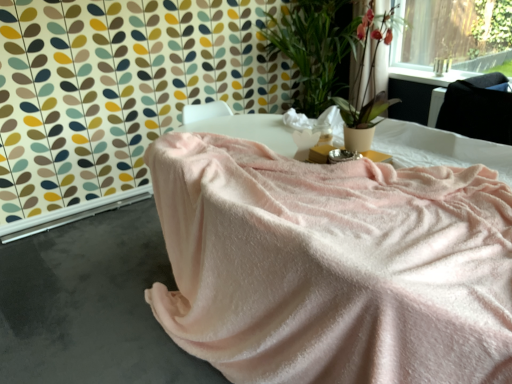
Question: Is pink soft fabric at lower left to the right of green leafy plant at upper right from the viewer's perspective?

Choices:
 (A) no
 (B) yes

Answer: (A)

Question: Is pink soft fabric at lower left located outside green leafy plant at upper right?

Choices:
 (A) yes
 (B) no

Answer: (A)

Question: Is pink soft fabric at lower left surrounding green leafy plant at upper right?

Choices:
 (A) yes
 (B) no

Answer: (B)

Question: From a real-world perspective, is pink soft fabric at lower left beneath green leafy plant at upper right?

Choices:
 (A) yes
 (B) no

Answer: (A)

Question: Is pink soft fabric at lower left positioned with its back to green leafy plant at upper right?

Choices:
 (A) yes
 (B) no

Answer: (B)

Question: In terms of height, does pink soft fabric at lower left look taller or shorter compared to pink fabric at upper right?

Choices:
 (A) tall
 (B) short

Answer: (B)

Question: From the image's perspective, relative to pink fabric at upper right, is pink soft fabric at lower left above or below?

Choices:
 (A) below
 (B) above

Answer: (A)

Question: Do you think pink soft fabric at lower left is within pink fabric at upper right, or outside of it?

Choices:
 (A) inside
 (B) outside

Answer: (B)

Question: Looking at the image, does pink soft fabric at lower left seem bigger or smaller compared to pink fabric at upper right?

Choices:
 (A) small
 (B) big

Answer: (B)

Question: From a real-world perspective, relative to green leafy plant at upper right, is satin black at upper right vertically above or below?

Choices:
 (A) above
 (B) below

Answer: (B)

Question: Would you say satin black at upper right is to the left or to the right of green leafy plant at upper right in the picture?

Choices:
 (A) right
 (B) left

Answer: (A)

Question: Is satin black at upper right inside the boundaries of green leafy plant at upper right, or outside?

Choices:
 (A) outside
 (B) inside

Answer: (A)

Question: From the image's perspective, relative to green leafy plant at upper right, is satin black at upper right above or below?

Choices:
 (A) below
 (B) above

Answer: (A)

Question: From the image's perspective, is green leafy plant at upper right located above or below pink soft fabric at lower left?

Choices:
 (A) below
 (B) above

Answer: (B)

Question: From a real-world perspective, is green leafy plant at upper right above or below pink soft fabric at lower left?

Choices:
 (A) below
 (B) above

Answer: (B)